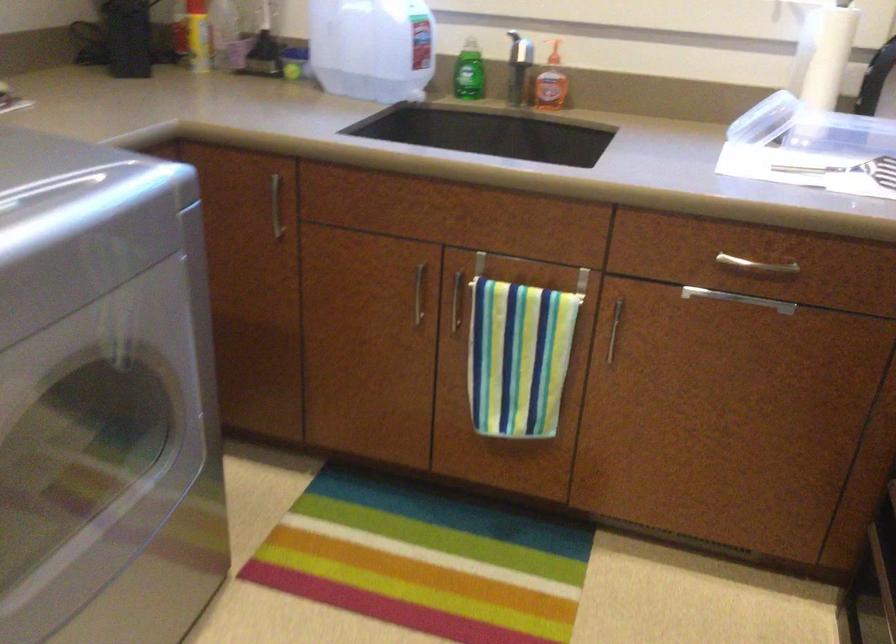
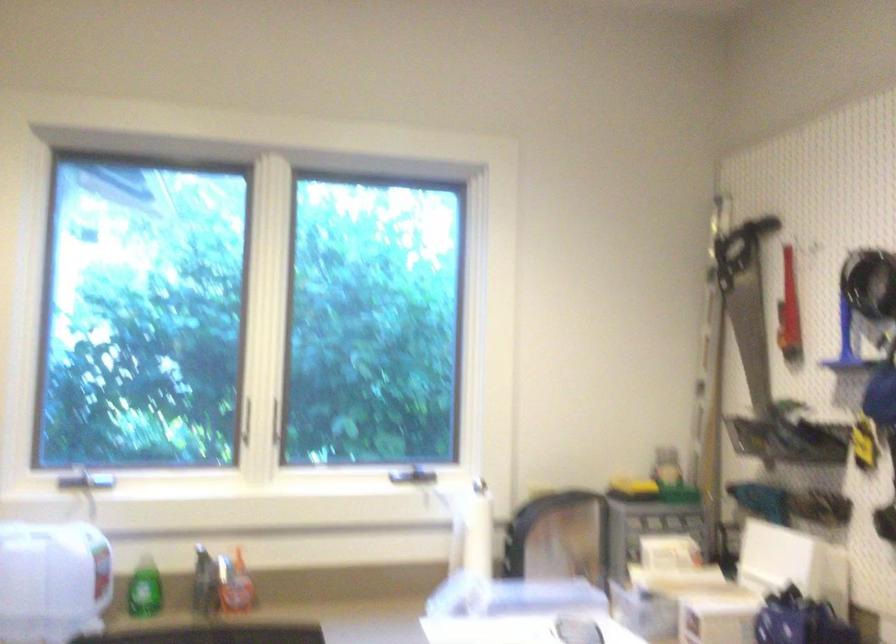
The point at (547, 79) is marked in the first image. Where is the corresponding point in the second image?

(234, 583)